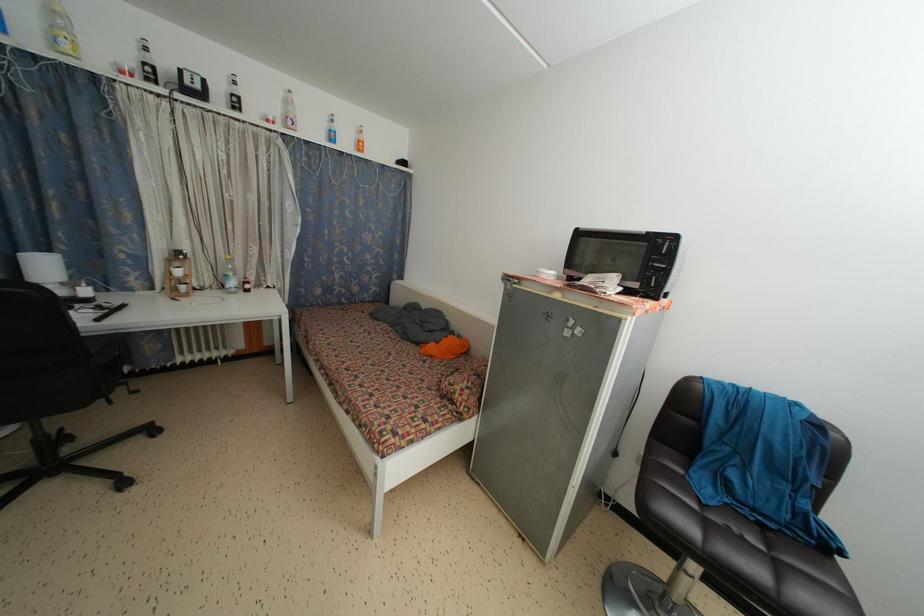
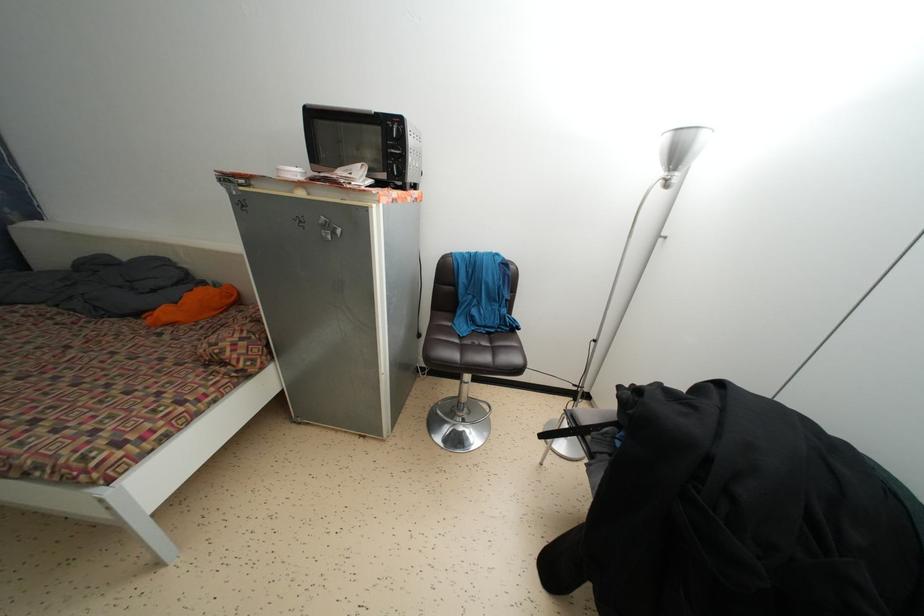
Locate, in the second image, the point that corresponds to point (767, 532) in the first image.

(492, 339)